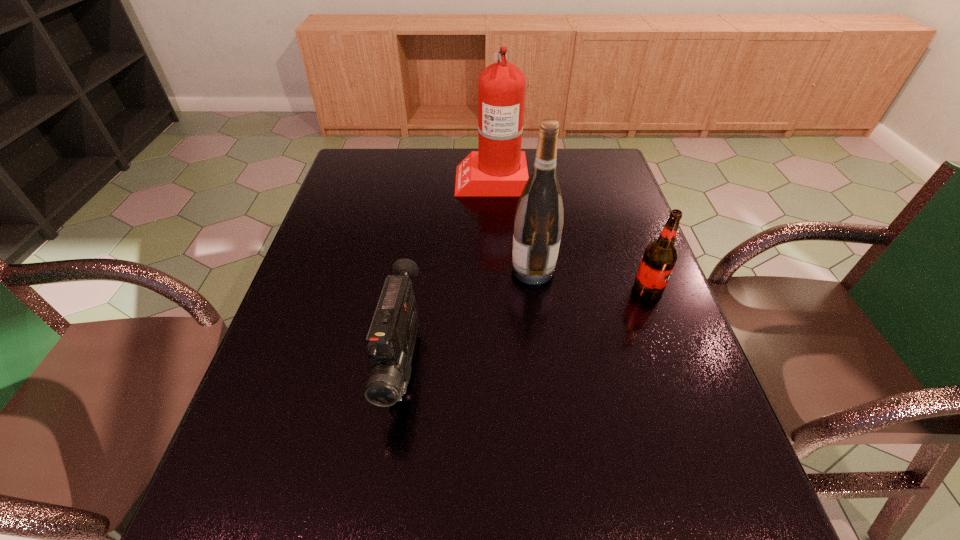
Find the location of a particular element. The image size is (960, 540). vacant region at the near left corner of the desktop is located at coordinates (267, 518).

Locate an element on the screen. The image size is (960, 540). vacant space at the far right corner is located at coordinates (608, 183).

Where is `unoccupied position between the shortest object and the rightmost object`? unoccupied position between the shortest object and the rightmost object is located at coordinates (525, 327).

This screenshot has width=960, height=540. I want to click on unoccupied position between the farthest object and the shortest object, so click(446, 272).

This screenshot has width=960, height=540. I want to click on free space between the camcorder and the third tallest object, so click(x=525, y=327).

Find the location of a particular element. This screenshot has width=960, height=540. free area in between the second shortest object and the leftmost object is located at coordinates (525, 327).

Locate an element on the screen. The height and width of the screenshot is (540, 960). empty space between the wine bottle and the shortest object is located at coordinates (468, 318).

Where is `free space between the wine bottle and the farthest object`? The image size is (960, 540). free space between the wine bottle and the farthest object is located at coordinates (512, 224).

The height and width of the screenshot is (540, 960). I want to click on free space between the shortest object and the wine bottle, so click(468, 318).

Where is `vacant region between the camcorder and the farthest object`? vacant region between the camcorder and the farthest object is located at coordinates (446, 272).